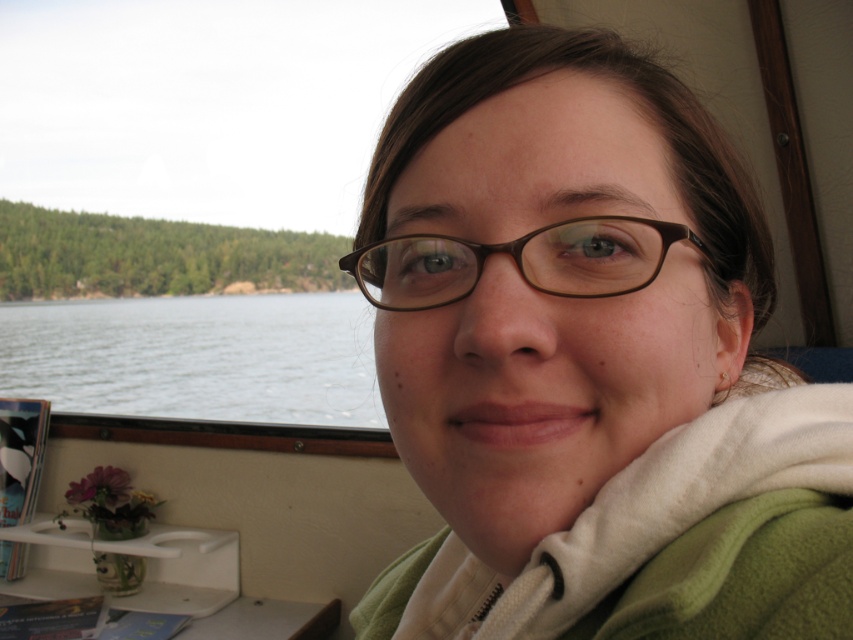
Question: Which object appears closest to the camera in this image?

Choices:
 (A) brown matte glasses at center
 (B) matte brown glasses at center

Answer: (B)

Question: Is clear water at window left wider than brown matte glasses at center?

Choices:
 (A) no
 (B) yes

Answer: (B)

Question: Which object is farther from the camera taking this photo?

Choices:
 (A) matte brown glasses at center
 (B) brown matte glasses at center
 (C) clear water at window left

Answer: (C)

Question: Is matte brown glasses at center wider than clear water at window left?

Choices:
 (A) no
 (B) yes

Answer: (B)

Question: Is matte brown glasses at center further to camera compared to clear water at window left?

Choices:
 (A) no
 (B) yes

Answer: (A)

Question: Which point appears closest to the camera in this image?

Choices:
 (A) (583, 269)
 (B) (74, 364)

Answer: (A)